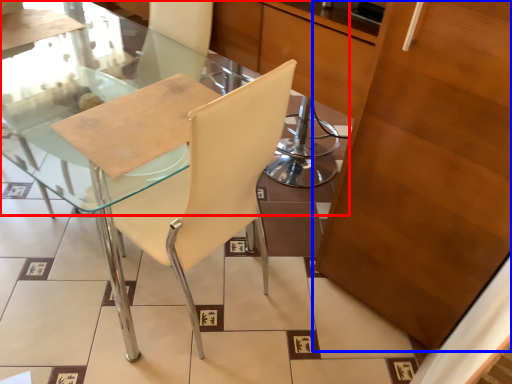
Question: Which object appears closest to the camera in this image, glass table (highlighted by a red box) or cabinetry (highlighted by a blue box)?

Choices:
 (A) glass table
 (B) cabinetry

Answer: (B)